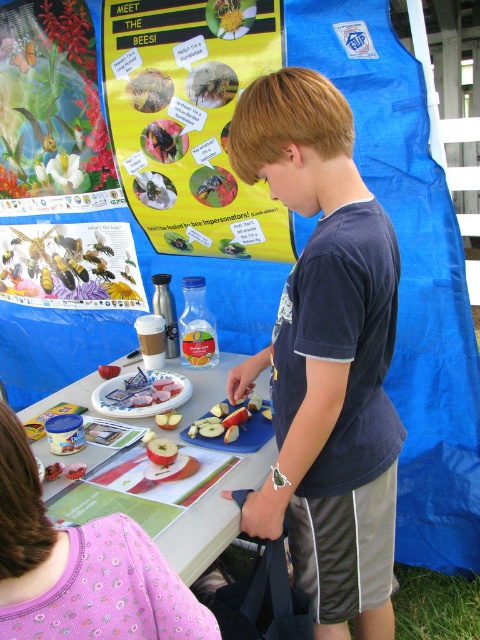
You are standing at the outdoor educational activity under the blue tarp. You see two points marked on the ground. One is at point coordinate (6, 246) and the other at point coordinate (191, 400). Which point is closer to you?

Point coordinate (6, 246) is closer to you because it is further to the viewer than point coordinate (191, 400).

You are at a community fair and see the white plastic table at center and the sliced red apple at lower center. Which object is located above the other?

The sliced red apple at lower center is above the white plastic table at center because the white plastic table at center is positioned under it.

You are at an outdoor educational event and see the yellow paper poster at upper center and the white plastic table at center. Which object is positioned to the right of the other?

The yellow paper poster at upper center is to the right of the white plastic table at center.